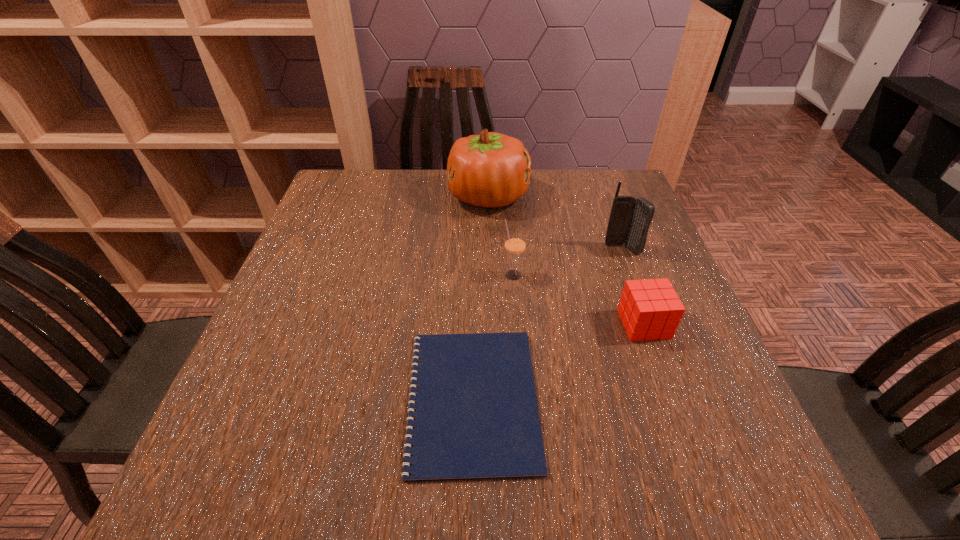
Where is `vacant space positioned on the right of the straw`? vacant space positioned on the right of the straw is located at coordinates (628, 275).

At what (x,y) coordinates should I click in order to perform the action: click on vacant space situated on the left of the cube. Please return your answer as a coordinate pair (x, y). The image size is (960, 540). Looking at the image, I should click on (567, 324).

At what (x,y) coordinates should I click in order to perform the action: click on blank area located on the back of the shortest object. Please return your answer as a coordinate pair (x, y). Image resolution: width=960 pixels, height=540 pixels. Looking at the image, I should click on (474, 287).

Find the location of a particular element. The width and height of the screenshot is (960, 540). object present at the far edge is located at coordinates (491, 170).

This screenshot has width=960, height=540. I want to click on object at the near edge, so click(x=476, y=417).

Where is `cellular telephone that is at the right edge`? cellular telephone that is at the right edge is located at coordinates pos(630,219).

You are a GUI agent. You are given a task and a screenshot of the screen. Output one action in this format:
    pyautogui.click(x=<x>, y=<y>)
    Task: Click on the cube situated at the right edge
    This screenshot has width=960, height=540.
    Given the screenshot: What is the action you would take?
    pyautogui.click(x=650, y=309)

In the image, there is a desktop. Where is `vacant space at the far edge`? The image size is (960, 540). vacant space at the far edge is located at coordinates (433, 199).

Where is `vacant region at the left edge of the desktop`? vacant region at the left edge of the desktop is located at coordinates (331, 218).

The width and height of the screenshot is (960, 540). Identify the location of free space at the right edge of the desktop. (706, 394).